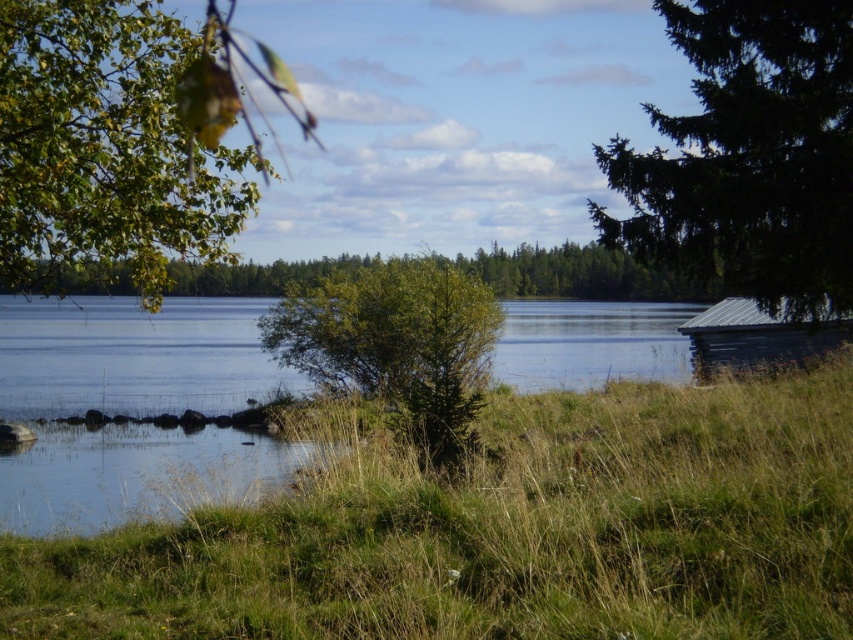
You are an artist trying to sketch this lakeside scene. You want to ensure the proportions between the green leafy branch at upper left and the green leafy bush at center are accurate. Which object should you draw wider in your sketch?

The green leafy branch at upper left should be drawn wider than the green leafy bush at center because its width is larger according to the description.

You are a bird looking for a place to perch. You see the green leafy branch at upper left and the green leafy tree at center. Which one is closer to the water?

The green leafy branch at upper left is closer to the water than the green leafy tree at center because they are 8.64 meters apart.

You are standing at the lakeside and want to take a photo of the wooden cabin at right. However, there is a green leafy tree at center blocking your view. Is there a way to move around the tree to get an unobstructed view of the cabin?

The green leafy tree at center is in front of the wooden cabin at right, so you can move around the tree to either side to get an unobstructed view of the cabin.